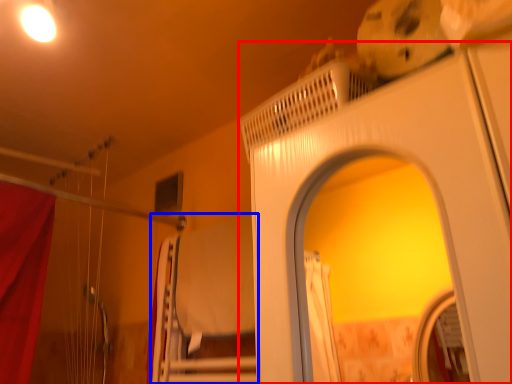
Question: Which object is closer to the camera taking this photo, screen door (highlighted by a red box) or bed (highlighted by a blue box)?

Choices:
 (A) screen door
 (B) bed

Answer: (A)